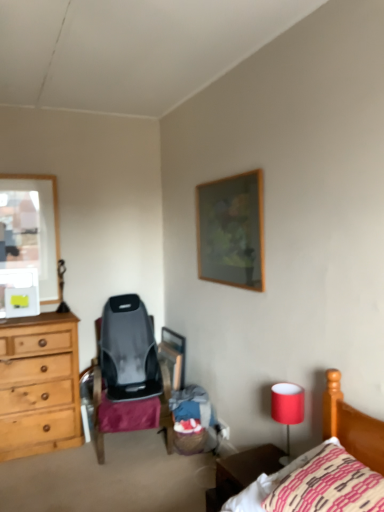
Question: Does knitted cotton pillow at lower right have a lesser height compared to wooden picture frame at upper center?

Choices:
 (A) yes
 (B) no

Answer: (A)

Question: Is knitted cotton pillow at lower right to the right of wooden picture frame at upper center from the viewer's perspective?

Choices:
 (A) no
 (B) yes

Answer: (B)

Question: Can you confirm if knitted cotton pillow at lower right is bigger than wooden picture frame at upper center?

Choices:
 (A) no
 (B) yes

Answer: (B)

Question: Is knitted cotton pillow at lower right at the left side of wooden picture frame at upper center?

Choices:
 (A) yes
 (B) no

Answer: (B)

Question: From a real-world perspective, is knitted cotton pillow at lower right on wooden picture frame at upper center?

Choices:
 (A) no
 (B) yes

Answer: (A)

Question: In the image, is red fabric lampshade at lower right positioned in front of or behind wooden picture frame at upper center?

Choices:
 (A) front
 (B) behind

Answer: (A)

Question: Based on their sizes in the image, would you say red fabric lampshade at lower right is bigger or smaller than wooden picture frame at upper center?

Choices:
 (A) big
 (B) small

Answer: (B)

Question: From a real-world perspective, relative to wooden picture frame at upper center, is red fabric lampshade at lower right vertically above or below?

Choices:
 (A) above
 (B) below

Answer: (B)

Question: Is red fabric lampshade at lower right taller or shorter than wooden picture frame at upper center?

Choices:
 (A) tall
 (B) short

Answer: (B)

Question: Looking at their shapes, would you say brown wooden nightstand at lower right is wider or thinner than wooden picture frame at upper center?

Choices:
 (A) thin
 (B) wide

Answer: (B)

Question: Is brown wooden nightstand at lower right bigger or smaller than wooden picture frame at upper center?

Choices:
 (A) small
 (B) big

Answer: (A)

Question: From a real-world perspective, relative to wooden picture frame at upper center, is brown wooden nightstand at lower right vertically above or below?

Choices:
 (A) above
 (B) below

Answer: (B)

Question: From the image's perspective, is brown wooden nightstand at lower right located above or below wooden picture frame at upper center?

Choices:
 (A) below
 (B) above

Answer: (A)

Question: Is point (345, 451) positioned closer to the camera than point (198, 266)?

Choices:
 (A) farther
 (B) closer

Answer: (B)

Question: Is knitted cotton pillow at lower right taller or shorter than wooden picture frame at upper center?

Choices:
 (A) short
 (B) tall

Answer: (A)